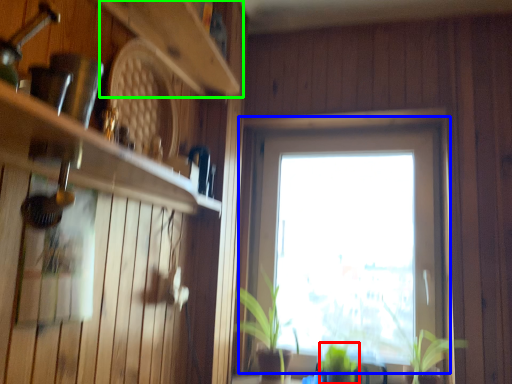
Question: Considering the real-world distances, which object is farthest from plant (highlighted by a red box)? window (highlighted by a blue box) or shelf (highlighted by a green box)?

Choices:
 (A) window
 (B) shelf

Answer: (B)